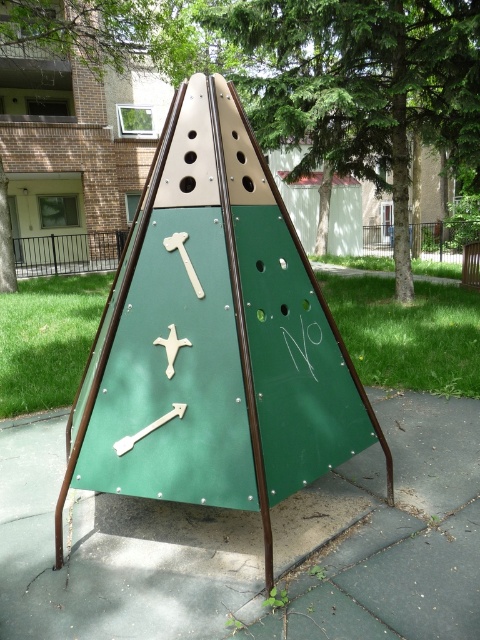
Measure the distance between point (294, 392) and camera.

Point (294, 392) is 2.74 meters from camera.

Between green matte triangle at center and green rubber pavement at center, which one appears on the right side from the viewer's perspective?

green rubber pavement at center

Does point (352, 387) lie in front of point (43, 444)?

Yes.

Locate an element on the screen. green matte triangle at center is located at coordinates (215, 337).